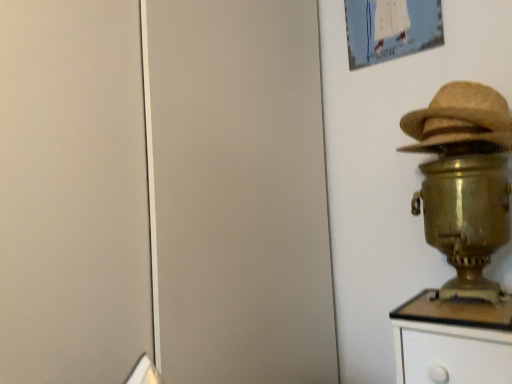
Question: In terms of height, does braided straw hat at right look taller or shorter compared to gold metallic samovar at right?

Choices:
 (A) tall
 (B) short

Answer: (B)

Question: Would you say braided straw hat at right is to the left or to the right of gold metallic samovar at right in the picture?

Choices:
 (A) right
 (B) left

Answer: (A)

Question: Which is nearer to the gold metallic samovar at right?

Choices:
 (A) braided straw hat at right
 (B) matte paper picture frame at upper right

Answer: (A)

Question: Which is farther from the braided straw hat at right?

Choices:
 (A) matte paper picture frame at upper right
 (B) gold metallic samovar at right

Answer: (A)